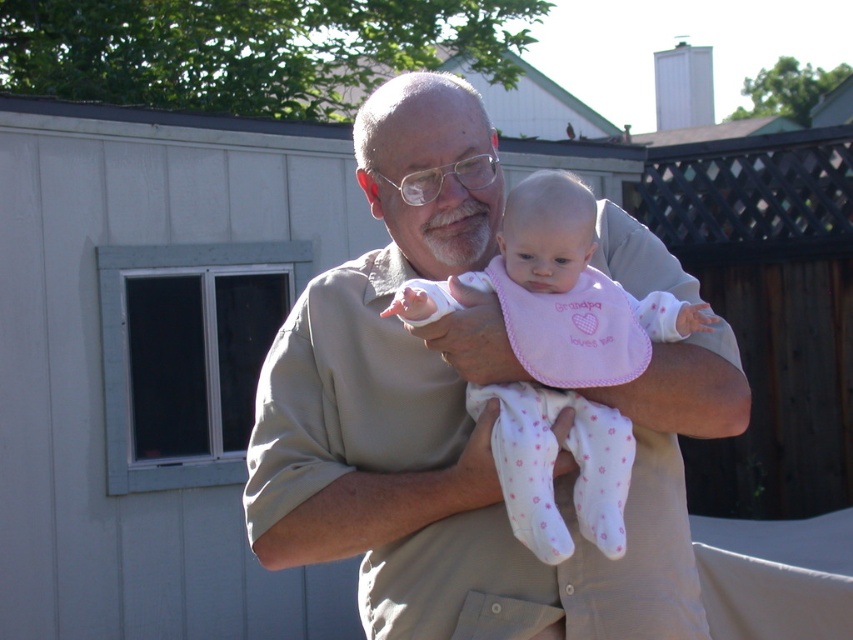
You are a tailor who needs to determine which item requires more fabric for alterations between the khaki cotton shirt at center and the pink fabric bib at center. Based on their sizes, which one would need more fabric?

The khaki cotton shirt at center requires more fabric for alterations because its width is larger than the pink fabric bib at center.

What is the exact location of the khaki cotton shirt at center in the image?

The khaki cotton shirt at center is located at point (457, 417).